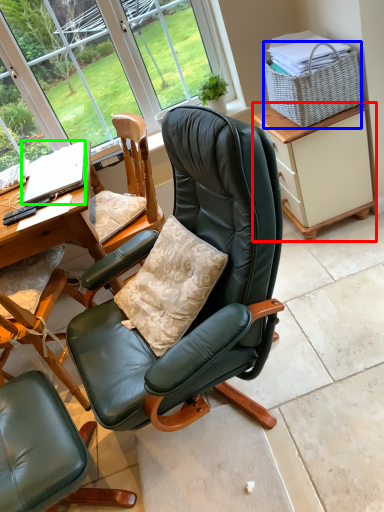
Question: Estimate the real-world distances between objects in this image. Which object is closer to cabinetry (highlighted by a red box), picnic basket (highlighted by a blue box) or laptop (highlighted by a green box)?

Choices:
 (A) picnic basket
 (B) laptop

Answer: (A)